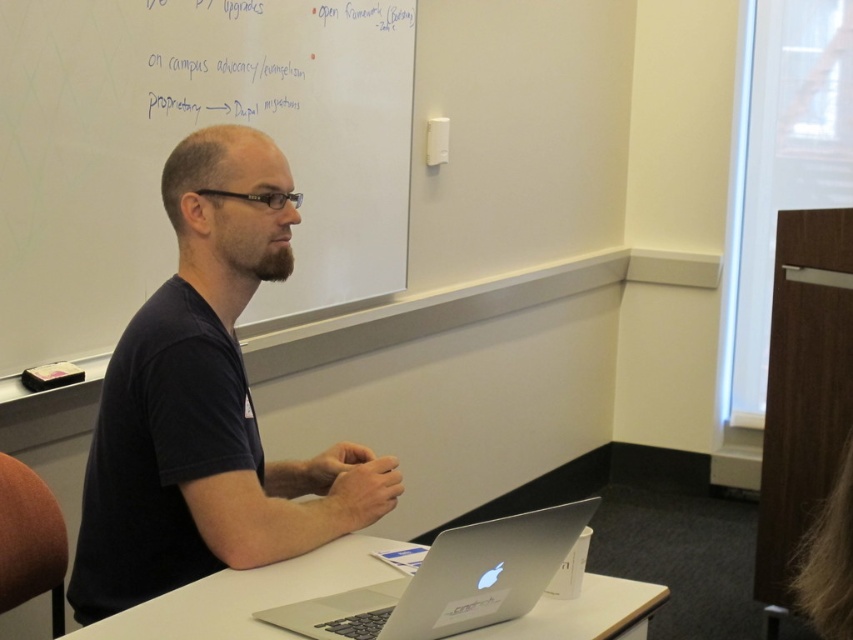
Between black matte shirt at center and silver metallic laptop at center, which one appears on the right side from the viewer's perspective?

From the viewer's perspective, silver metallic laptop at center appears more on the right side.

Which is below, black matte shirt at center or silver metallic laptop at center?

silver metallic laptop at center

Identify the location of black matte shirt at center. (206, 403).

Which is behind, point (254, 419) or point (483, 545)?

Positioned behind is point (254, 419).

Which is more to the left, black matte shirt at center or sleek silver laptop at center?

black matte shirt at center is more to the left.

At what (x,y) coordinates should I click in order to perform the action: click on black matte shirt at center. Please return your answer as a coordinate pair (x, y). Looking at the image, I should click on (206, 403).

Who is taller, silver metallic laptop at center or sleek silver laptop at center?

sleek silver laptop at center is taller.

Can you confirm if silver metallic laptop at center is positioned above sleek silver laptop at center?

No, silver metallic laptop at center is not above sleek silver laptop at center.

Who is more forward, (305, 557) or (517, 600)?

Point (517, 600) is in front.

What are the coordinates of `silver metallic laptop at center` in the screenshot? It's located at (248, 595).